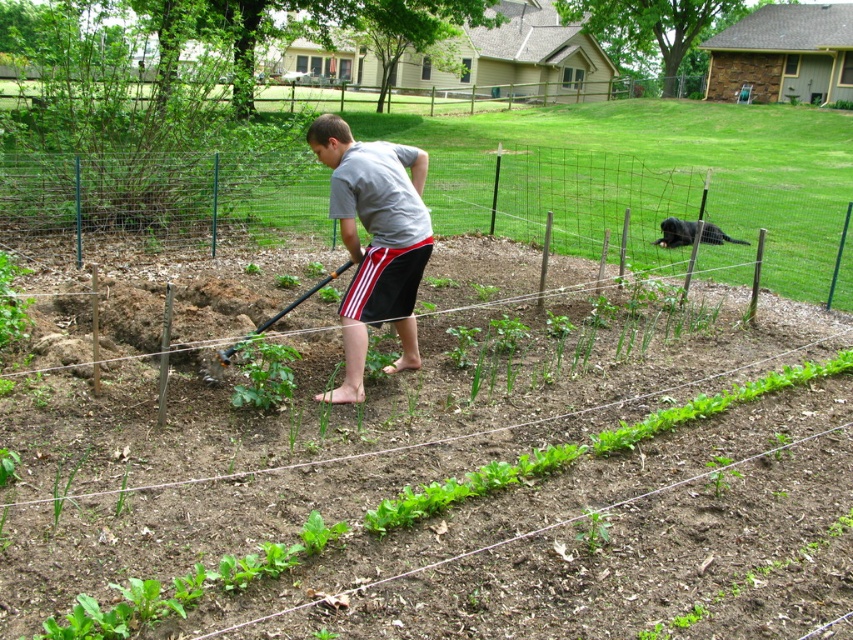
You are a visitor in the backyard and want to know which object is taller between the brushed metal shovel at center and the black fur dog at upper right. Can you tell me?

The brushed metal shovel at center is taller than the black fur dog at upper right according to the description.

You are a visitor in the backyard and want to know if the matte gray shirt at center is bigger than the black fur dog at upper right. Can you tell me?

The matte gray shirt at center has a larger size compared to the black fur dog at upper right, so yes, the matte gray shirt at center is bigger than the black fur dog at upper right.